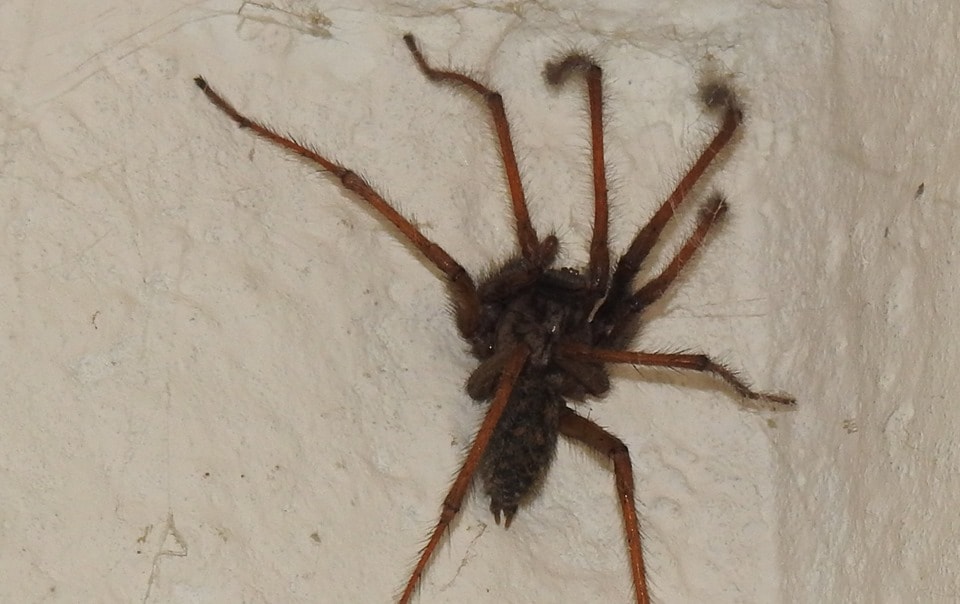
The width and height of the screenshot is (960, 604). What are the coordinates of `concrete wall behind spider` in the screenshot? It's located at pos(270,217).